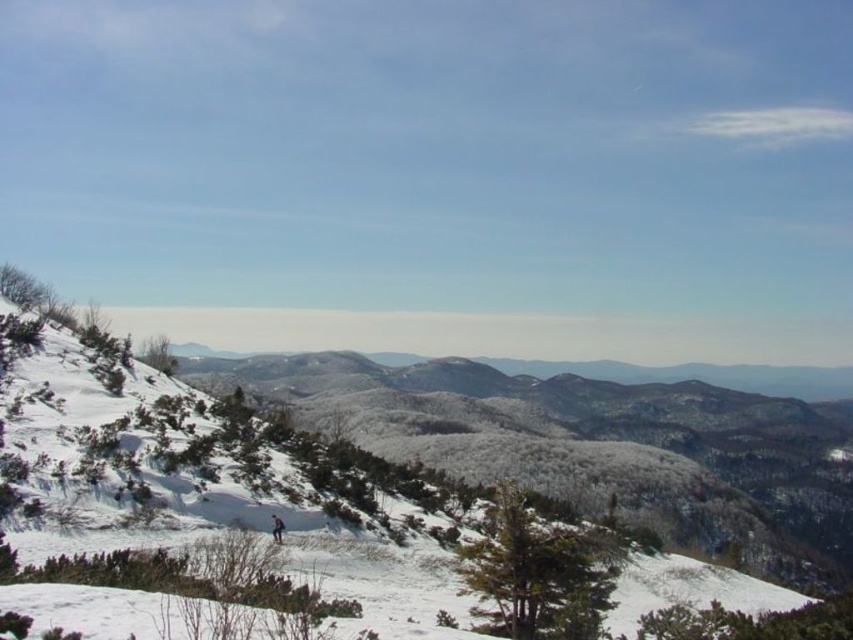
Does point (86, 376) come closer to viewer compared to point (279, 524)?

No, it is not.

Does point (741, 518) lie in front of point (282, 531)?

No, (741, 518) is further to viewer.

The image size is (853, 640). I want to click on white snow-covered mountain at left, so coord(340,460).